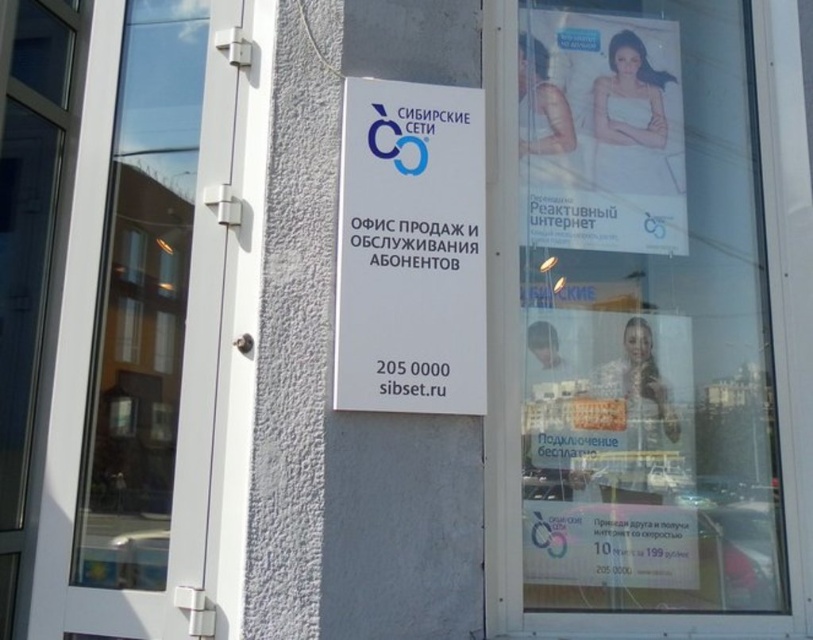
You are a delivery person trying to locate the office entrance. You see the transparent glass window at left and the white plastic sign at center. Which object is taller?

The transparent glass window at left is taller than the white plastic sign at center.

You are standing in front of the building with the signboard. You need to enter the building through the transparent glass window at left. Can you see the signboard from the entrance?

Yes, the transparent glass window at left is positioned at point (142, 298), so you can see the signboard from the entrance.